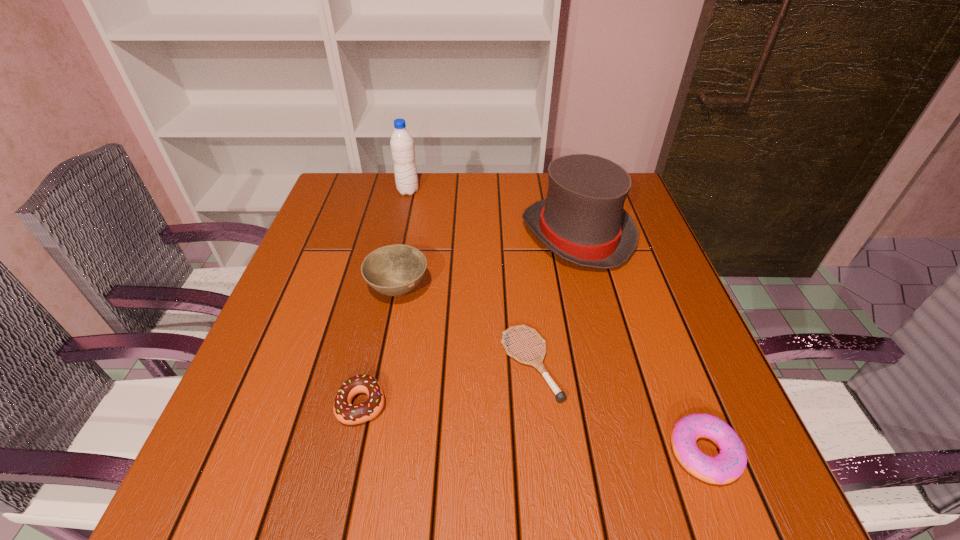
You are a GUI agent. You are given a task and a screenshot of the screen. Output one action in this format:
    pyautogui.click(x=<x>, y=<y>)
    Task: Click on the free space at the far edge of the desktop
    The image size is (960, 540).
    Given the screenshot: What is the action you would take?
    pyautogui.click(x=451, y=207)

The height and width of the screenshot is (540, 960). Identify the location of vacant space at the near edge. (349, 467).

Where is `free space at the left edge of the desktop`? This screenshot has width=960, height=540. free space at the left edge of the desktop is located at coordinates (300, 349).

Find the location of a particular element. free space at the right edge is located at coordinates (640, 242).

Where is `vacant space at the near left corner`? The width and height of the screenshot is (960, 540). vacant space at the near left corner is located at coordinates (223, 462).

You are a GUI agent. You are given a task and a screenshot of the screen. Output one action in this format:
    pyautogui.click(x=<x>, y=<y>)
    Task: Click on the vacant space that's between the dress hat and the right doughnut
    
    Given the screenshot: What is the action you would take?
    pyautogui.click(x=641, y=344)

Find the location of a particular element. free point between the shortest object and the left doughnut is located at coordinates (446, 384).

Identify the location of free space between the second tallest object and the shortest object. The image size is (960, 540). (554, 299).

At what (x,y) coordinates should I click in order to perform the action: click on free spot between the right doughnut and the fourth shortest object. Please return your answer as a coordinate pair (x, y). This screenshot has width=960, height=540. Looking at the image, I should click on click(551, 371).

Where is `free space between the tennis racket and the fifth shortest object`? The image size is (960, 540). free space between the tennis racket and the fifth shortest object is located at coordinates (554, 299).